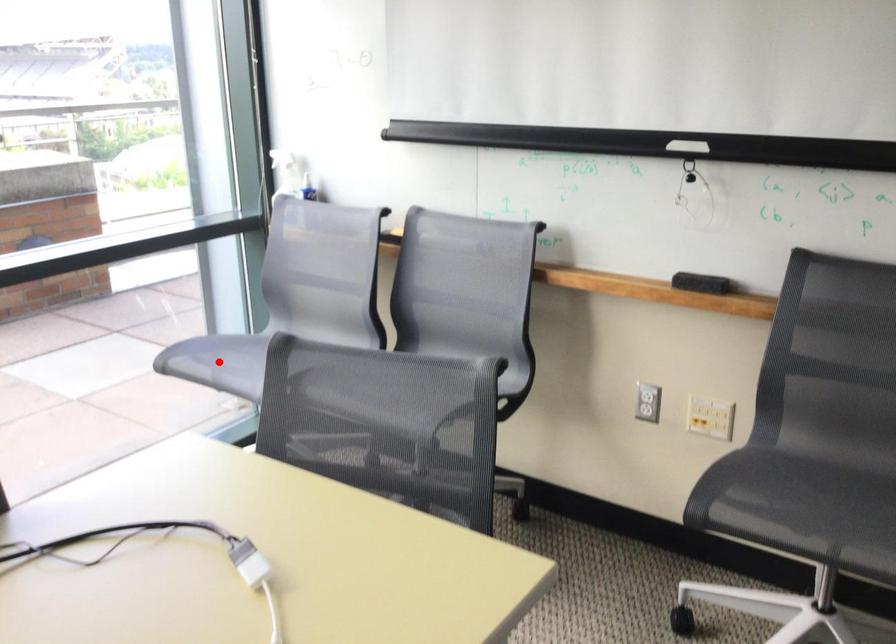
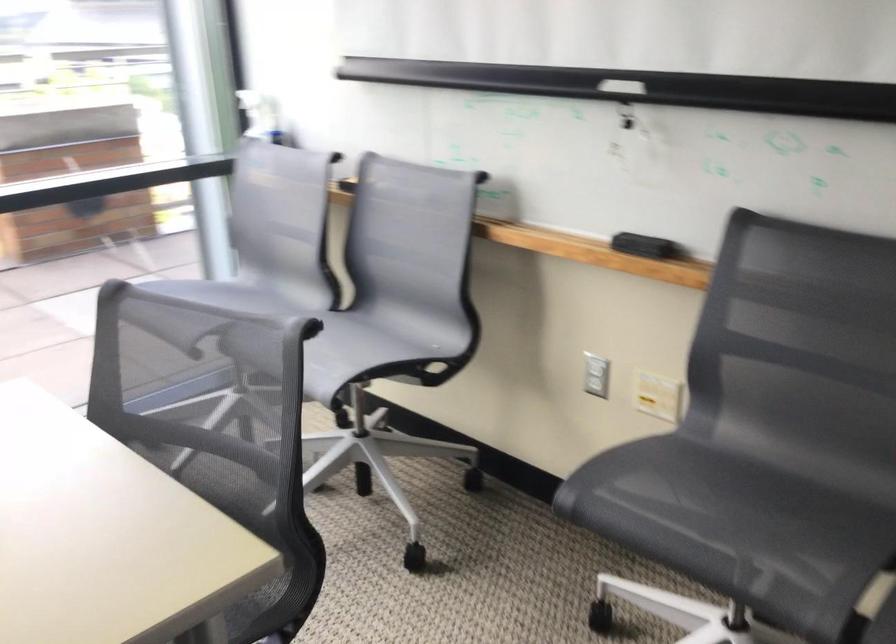
Question: I am providing you with two images of the same scene from different viewpoints. A red point is marked on the first image. Is the red point's position out of view in image 2?

Choices:
 (A) Yes
 (B) No

Answer: (A)